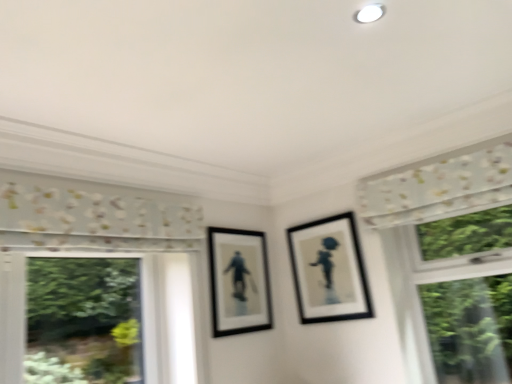
In order to click on matte black picture frame at center, which ranks as the 1th picture frame in left-to-right order in this screenshot , I will do `click(239, 281)`.

Where is `white floral fabric at upper right`? white floral fabric at upper right is located at coordinates (439, 185).

Locate an element on the screen. This screenshot has height=384, width=512. matte black picture frame at center, which ranks as the 1th picture frame in left-to-right order is located at coordinates (239, 281).

From a real-world perspective, is black matte picture frame at upper right, which ranks as the second picture frame in left-to-right order, physically below white floral fabric at upper right?

Indeed, from a real-world perspective, black matte picture frame at upper right, which ranks as the second picture frame in left-to-right order, is positioned beneath white floral fabric at upper right.

This screenshot has width=512, height=384. I want to click on curtain located above the black matte picture frame at upper right, which is counted as the first picture frame, starting from the right (from the image's perspective), so click(439, 185).

Considering the relative positions of black matte picture frame at upper right, which ranks as the second picture frame in left-to-right order, and white floral fabric at upper right in the image provided, is black matte picture frame at upper right, which ranks as the second picture frame in left-to-right order, in front of white floral fabric at upper right?

No, black matte picture frame at upper right, which ranks as the second picture frame in left-to-right order, is further to the viewer.

Which object is closer to the camera taking this photo, white floral fabric at upper right or matte black picture frame at center, which is counted as the second picture frame, starting from the right?

white floral fabric at upper right is more forward.

From a real-world perspective, does white floral fabric at upper right stand above matte black picture frame at center, which is counted as the second picture frame, starting from the right?

Yes, from a real-world perspective, white floral fabric at upper right is above matte black picture frame at center, which is counted as the second picture frame, starting from the right.

Measure the distance from white floral fabric at upper right to matte black picture frame at center, which is counted as the second picture frame, starting from the right.

35.06 inches.

Is white floral fabric at upper right aimed at matte black picture frame at center, which is counted as the second picture frame, starting from the right?

No, white floral fabric at upper right does not turn towards matte black picture frame at center, which is counted as the second picture frame, starting from the right.

You are a GUI agent. You are given a task and a screenshot of the screen. Output one action in this format:
    pyautogui.click(x=<x>, y=<y>)
    Task: Click on the curtain on the right of matte black picture frame at center, which is counted as the second picture frame, starting from the right
    The height and width of the screenshot is (384, 512).
    Given the screenshot: What is the action you would take?
    pyautogui.click(x=439, y=185)

Considering the relative positions of matte black picture frame at center, which is counted as the second picture frame, starting from the right, and white floral fabric at upper right in the image provided, is matte black picture frame at center, which is counted as the second picture frame, starting from the right, to the left of white floral fabric at upper right from the viewer's perspective?

Yes, matte black picture frame at center, which is counted as the second picture frame, starting from the right, is to the left of white floral fabric at upper right.

Who is bigger, matte black picture frame at center, which is counted as the second picture frame, starting from the right, or white floral fabric at upper right?

With larger size is white floral fabric at upper right.

Is matte black picture frame at center, which ranks as the 1th picture frame in left-to-right order, taller than white floral fabric at upper right?

Yes, matte black picture frame at center, which ranks as the 1th picture frame in left-to-right order, is taller than white floral fabric at upper right.

Could you tell me if white floral fabric at upper right is turned towards black matte picture frame at upper right, which ranks as the second picture frame in left-to-right order?

No, white floral fabric at upper right is not turned towards black matte picture frame at upper right, which ranks as the second picture frame in left-to-right order.

From the image's perspective, which is above, white floral fabric at upper right or black matte picture frame at upper right, which is counted as the first picture frame, starting from the right?

white floral fabric at upper right.

Would you say white floral fabric at upper right is a long distance from black matte picture frame at upper right, which ranks as the second picture frame in left-to-right order?

No.

How many degrees apart are the facing directions of white floral fabric at upper right and black matte picture frame at upper right, which ranks as the second picture frame in left-to-right order?

The angle between the facing direction of white floral fabric at upper right and the facing direction of black matte picture frame at upper right, which ranks as the second picture frame in left-to-right order, is 0.426 degrees.

Which object is positioned more to the left, black matte picture frame at upper right, which is counted as the first picture frame, starting from the right, or matte black picture frame at center, which is counted as the second picture frame, starting from the right?

Positioned to the left is matte black picture frame at center, which is counted as the second picture frame, starting from the right.

Does black matte picture frame at upper right, which is counted as the first picture frame, starting from the right, turn towards matte black picture frame at center, which ranks as the 1th picture frame in left-to-right order?

Yes, black matte picture frame at upper right, which is counted as the first picture frame, starting from the right, is aimed at matte black picture frame at center, which ranks as the 1th picture frame in left-to-right order.

From a real-world perspective, which object rests below the other?

matte black picture frame at center, which ranks as the 1th picture frame in left-to-right order, is physically lower.

Is matte black picture frame at center, which is counted as the second picture frame, starting from the right, touching black matte picture frame at upper right, which is counted as the first picture frame, starting from the right?

No, matte black picture frame at center, which is counted as the second picture frame, starting from the right, is not next to black matte picture frame at upper right, which is counted as the first picture frame, starting from the right.

Is matte black picture frame at center, which is counted as the second picture frame, starting from the right, surrounding black matte picture frame at upper right, which ranks as the second picture frame in left-to-right order?

That's incorrect, black matte picture frame at upper right, which ranks as the second picture frame in left-to-right order, is not inside matte black picture frame at center, which is counted as the second picture frame, starting from the right.

Is matte black picture frame at center, which ranks as the 1th picture frame in left-to-right order, oriented away from black matte picture frame at upper right, which ranks as the second picture frame in left-to-right order?

No, black matte picture frame at upper right, which ranks as the second picture frame in left-to-right order, is not at the back of matte black picture frame at center, which ranks as the 1th picture frame in left-to-right order.

Which of these two, matte black picture frame at center, which ranks as the 1th picture frame in left-to-right order, or black matte picture frame at upper right, which ranks as the second picture frame in left-to-right order, is wider?

Wider between the two is black matte picture frame at upper right, which ranks as the second picture frame in left-to-right order.

Identify the location of curtain in front of the black matte picture frame at upper right, which is counted as the first picture frame, starting from the right. (439, 185).

Where is `the 2nd picture frame to the left when counting from the white floral fabric at upper right`? This screenshot has width=512, height=384. the 2nd picture frame to the left when counting from the white floral fabric at upper right is located at coordinates (239, 281).

Looking at the image, which one is located further to white floral fabric at upper right, matte black picture frame at center, which ranks as the 1th picture frame in left-to-right order, or black matte picture frame at upper right, which ranks as the second picture frame in left-to-right order?

matte black picture frame at center, which ranks as the 1th picture frame in left-to-right order, is further to white floral fabric at upper right.

From the image, which object appears to be nearer to black matte picture frame at upper right, which is counted as the first picture frame, starting from the right, matte black picture frame at center, which is counted as the second picture frame, starting from the right, or white floral fabric at upper right?

The object closer to black matte picture frame at upper right, which is counted as the first picture frame, starting from the right, is matte black picture frame at center, which is counted as the second picture frame, starting from the right.

Looking at the image, which one is located further to black matte picture frame at upper right, which is counted as the first picture frame, starting from the right, white floral fabric at upper right or matte black picture frame at center, which ranks as the 1th picture frame in left-to-right order?

white floral fabric at upper right is positioned further to the anchor black matte picture frame at upper right, which is counted as the first picture frame, starting from the right.

Consider the image. Looking at the image, which one is located further to matte black picture frame at center, which ranks as the 1th picture frame in left-to-right order, white floral fabric at upper right or black matte picture frame at upper right, which is counted as the first picture frame, starting from the right?

Among the two, white floral fabric at upper right is located further to matte black picture frame at center, which ranks as the 1th picture frame in left-to-right order.

Based on their spatial positions, is black matte picture frame at upper right, which ranks as the second picture frame in left-to-right order, or white floral fabric at upper right further from matte black picture frame at center, which is counted as the second picture frame, starting from the right?

white floral fabric at upper right is further to matte black picture frame at center, which is counted as the second picture frame, starting from the right.

When comparing their distances from white floral fabric at upper right, does black matte picture frame at upper right, which is counted as the first picture frame, starting from the right, or matte black picture frame at center, which ranks as the 1th picture frame in left-to-right order, seem further?

matte black picture frame at center, which ranks as the 1th picture frame in left-to-right order, is positioned further to the anchor white floral fabric at upper right.

Where is `picture frame between matte black picture frame at center, which is counted as the second picture frame, starting from the right, and white floral fabric at upper right`? The image size is (512, 384). picture frame between matte black picture frame at center, which is counted as the second picture frame, starting from the right, and white floral fabric at upper right is located at coordinates (329, 270).